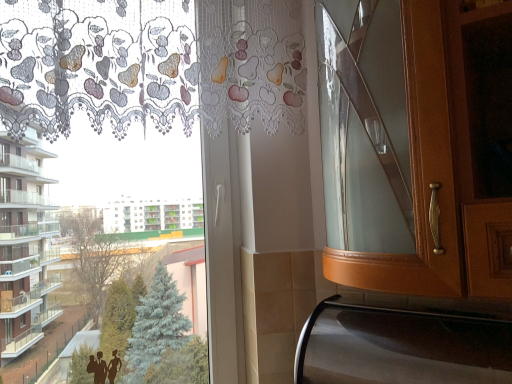
This screenshot has height=384, width=512. Describe the element at coordinates (102, 62) in the screenshot. I see `white lace curtain at upper left` at that location.

At what (x,y) coordinates should I click in order to perform the action: click on white lace curtain at upper left. Please return your answer as a coordinate pair (x, y). This screenshot has width=512, height=384. Looking at the image, I should click on (102, 62).

Measure the distance between point (317,327) and camera.

3.29 feet.

In order to face shiny metallic oven at lower right, should I rotate leftwards or rightwards?

Turn right approximately 18.733 degrees to face it.

What do you see at coordinates (401, 347) in the screenshot? The image size is (512, 384). I see `shiny metallic oven at lower right` at bounding box center [401, 347].

The width and height of the screenshot is (512, 384). Find the location of `shiny metallic oven at lower right`. shiny metallic oven at lower right is located at coordinates (401, 347).

Locate an element on the screen. white lace curtain at upper left is located at coordinates (102, 62).

Between shiny metallic oven at lower right and white lace curtain at upper left, which one appears on the left side from the viewer's perspective?

Positioned to the left is white lace curtain at upper left.

Is shiny metallic oven at lower right positioned before white lace curtain at upper left?

Yes.

Is point (476, 371) positioned in front of point (96, 43)?

Yes, point (476, 371) is closer to viewer.

From the image's perspective, is shiny metallic oven at lower right above or below white lace curtain at upper left?

From the image's perspective, shiny metallic oven at lower right appears below white lace curtain at upper left.

From a real-world perspective, is shiny metallic oven at lower right on top of white lace curtain at upper left?

No, from a real-world perspective, shiny metallic oven at lower right is not over white lace curtain at upper left

Between shiny metallic oven at lower right and white lace curtain at upper left, which one has smaller width?

white lace curtain at upper left.

Is shiny metallic oven at lower right shorter than white lace curtain at upper left?

Yes, shiny metallic oven at lower right is shorter than white lace curtain at upper left.

Considering the relative sizes of shiny metallic oven at lower right and white lace curtain at upper left in the image provided, is shiny metallic oven at lower right bigger than white lace curtain at upper left?

Incorrect, shiny metallic oven at lower right is not larger than white lace curtain at upper left.

Choose the correct answer: Is shiny metallic oven at lower right inside white lace curtain at upper left or outside it?

shiny metallic oven at lower right exists outside the volume of white lace curtain at upper left.

Looking at this image, is the surface of shiny metallic oven at lower right in direct contact with white lace curtain at upper left?

shiny metallic oven at lower right and white lace curtain at upper left are clearly separated.

Is shiny metallic oven at lower right aimed at white lace curtain at upper left?

No, shiny metallic oven at lower right is not facing towards white lace curtain at upper left.

What's the angular difference between shiny metallic oven at lower right and white lace curtain at upper left's facing directions?

shiny metallic oven at lower right and white lace curtain at upper left are facing 44.9 degrees away from each other.

Where is `oven below the white lace curtain at upper left (from a real-world perspective)`? This screenshot has width=512, height=384. oven below the white lace curtain at upper left (from a real-world perspective) is located at coordinates (401, 347).

Is white lace curtain at upper left to the left or to the right of shiny metallic oven at lower right in the image?

From the image, it's evident that white lace curtain at upper left is to the left of shiny metallic oven at lower right.

In the image, is white lace curtain at upper left positioned in front of or behind shiny metallic oven at lower right?

Clearly, white lace curtain at upper left is behind shiny metallic oven at lower right.

Is point (22, 31) farther from camera compared to point (336, 320)?

No, it is not.

From the image's perspective, is white lace curtain at upper left located above shiny metallic oven at lower right?

Yes, from the image's perspective, white lace curtain at upper left is above shiny metallic oven at lower right.

From a real-world perspective, is white lace curtain at upper left positioned under shiny metallic oven at lower right based on gravity?

No, from a real-world perspective, white lace curtain at upper left is not beneath shiny metallic oven at lower right.

Is white lace curtain at upper left thinner than shiny metallic oven at lower right?

Correct, the width of white lace curtain at upper left is less than that of shiny metallic oven at lower right.

Is white lace curtain at upper left taller or shorter than shiny metallic oven at lower right?

In the image, white lace curtain at upper left appears to be taller than shiny metallic oven at lower right.

Which of these two, white lace curtain at upper left or shiny metallic oven at lower right, is bigger?

white lace curtain at upper left.

Is white lace curtain at upper left positioned beyond the bounds of shiny metallic oven at lower right?

white lace curtain at upper left lies outside shiny metallic oven at lower right's area.

Is white lace curtain at upper left next to shiny metallic oven at lower right?

No.

Is white lace curtain at upper left facing towards shiny metallic oven at lower right?

No, white lace curtain at upper left is not oriented towards shiny metallic oven at lower right.

How many degrees apart are the facing directions of white lace curtain at upper left and shiny metallic oven at lower right?

They differ by 44.9 degrees in their facing directions.

Find the location of a particular element. The width and height of the screenshot is (512, 384). bay window above the shiny metallic oven at lower right (from a real-world perspective) is located at coordinates (102, 62).

Locate an element on the screen. The image size is (512, 384). oven that appears below the white lace curtain at upper left (from a real-world perspective) is located at coordinates (401, 347).

In the image, there is a shiny metallic oven at lower right. Where is `bay window above it (from the image's perspective)`? The height and width of the screenshot is (384, 512). bay window above it (from the image's perspective) is located at coordinates (102, 62).